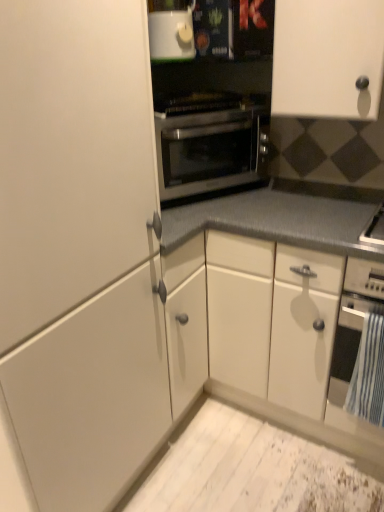
Find the location of a particular element. This screenshot has height=512, width=384. vacant space to the right of stainless steel oven at center, the 1th oven viewed from the top is located at coordinates (312, 198).